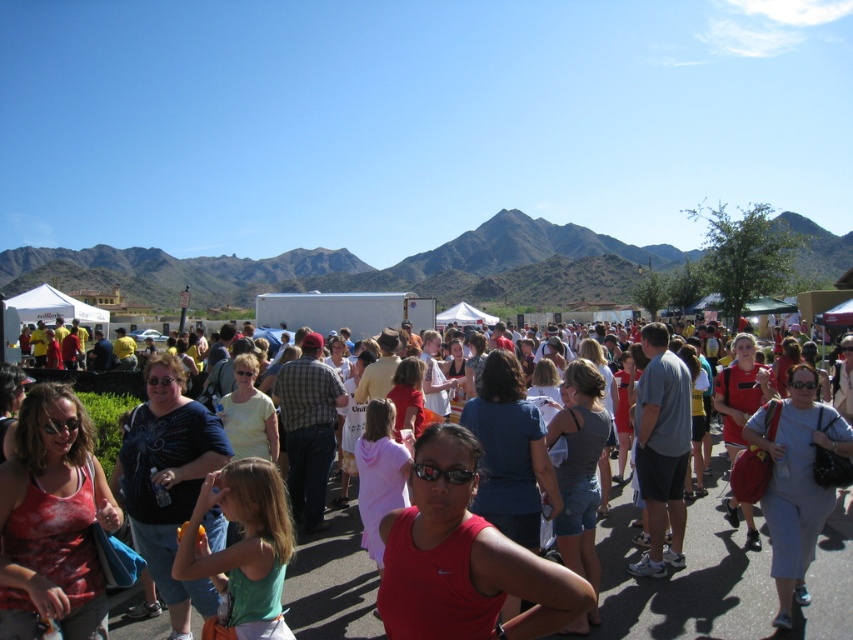
Question: From the image, what is the correct spatial relationship of green grassy mountain at upper center in relation to matte red tank top at center?

Choices:
 (A) above
 (B) below

Answer: (A)

Question: Which of the following is the closest to the observer?

Choices:
 (A) green grassy mountain at upper center
 (B) matte red tank top at center

Answer: (B)

Question: Is green grassy mountain at upper center behind matte red tank top at center?

Choices:
 (A) no
 (B) yes

Answer: (B)

Question: Which point is closer to the camera?

Choices:
 (A) green grassy mountain at upper center
 (B) matte red tank top at center

Answer: (B)

Question: Does green grassy mountain at upper center appear under matte red tank top at center?

Choices:
 (A) no
 (B) yes

Answer: (A)